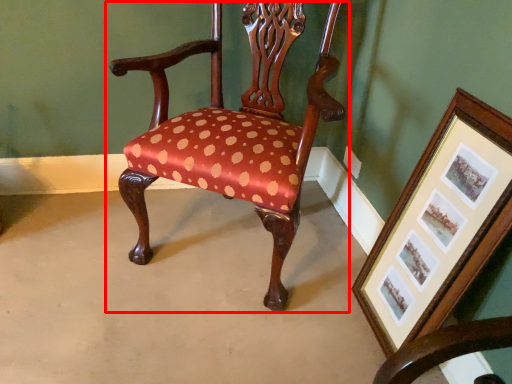
Question: From the image's perspective, where is chair (annotated by the red box) located in relation to picture frame in the image?

Choices:
 (A) below
 (B) above

Answer: (B)